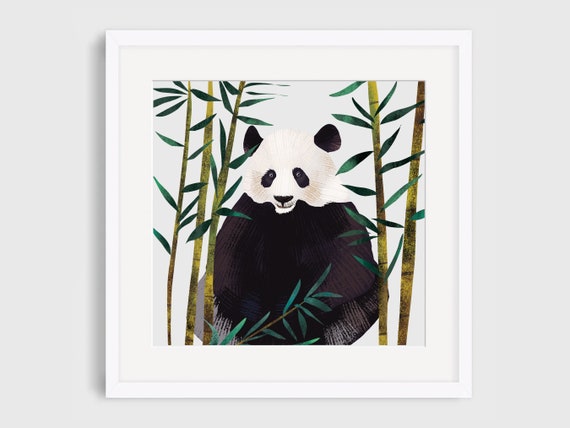
You are a GUI agent. You are given a task and a screenshot of the screen. Output one action in this format:
    pyautogui.click(x=<x>, y=<y>)
    Task: Click on the gray wall
    The width and height of the screenshot is (570, 428).
    Given the screenshot: What is the action you would take?
    pyautogui.click(x=20, y=144)